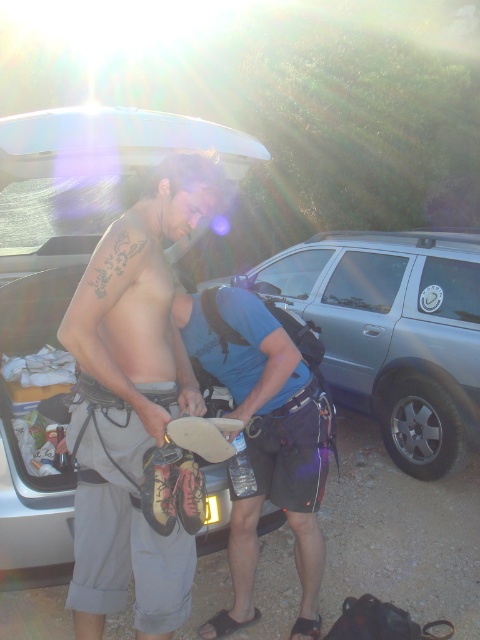
You are observing two people preparing for an outdoor activity. Both are wearing clothing items labeled as gray fabric shorts at center and blue fabric shirt at center. Which clothing item is positioned higher on their bodies?

The gray fabric shorts at center is located above the blue fabric shirt at center, so the gray fabric shorts at center is positioned higher on their bodies.

You are standing at point (206, 310) and want to walk to point (196, 412). Is the destination point in front of or behind your current position?

The destination point (196, 412) is in front of your current position at point (206, 310).